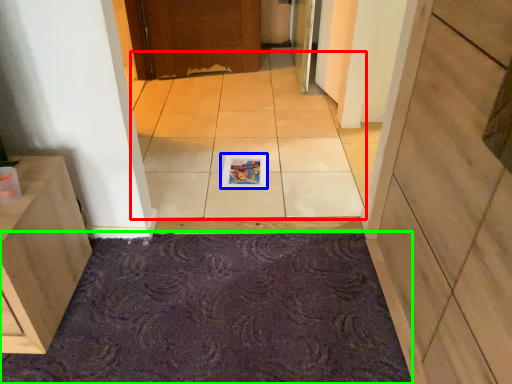
Question: Which object is the closest to the ceramic tile (highlighted by a red box)? Choose among these: magazine (highlighted by a blue box) or bath mat (highlighted by a green box).

Choices:
 (A) magazine
 (B) bath mat

Answer: (A)